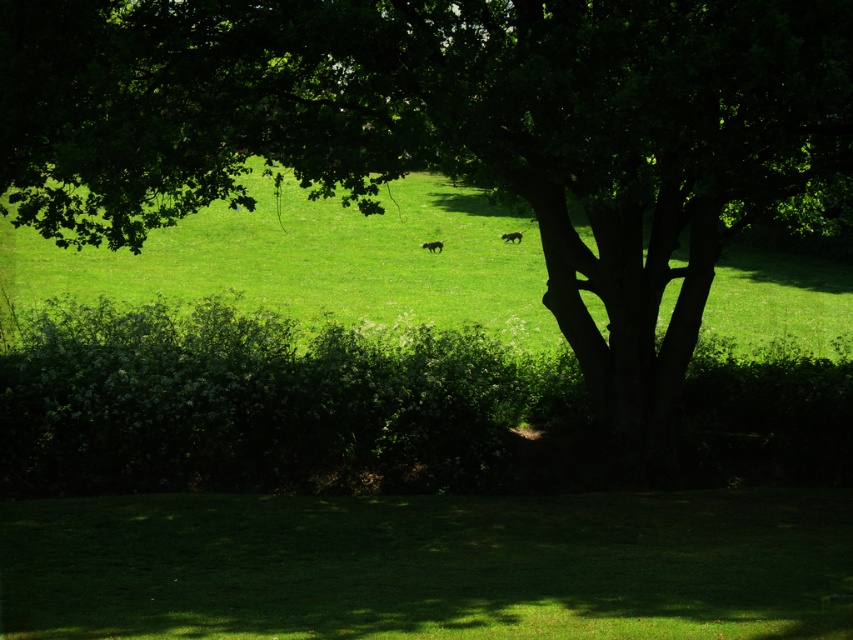
Question: Which point is closer to the camera taking this photo?

Choices:
 (A) (38, 400)
 (B) (428, 241)

Answer: (A)

Question: Which point appears farthest from the camera in this image?

Choices:
 (A) (142, 390)
 (B) (503, 234)

Answer: (B)

Question: Which of these objects is positioned closest to the green leafy tree at center?

Choices:
 (A) green leafy hedge at lower center
 (B) green grassy field at center
 (C) brown fur dog at center

Answer: (B)

Question: Does green leafy tree at center have a greater width compared to green leafy hedge at lower center?

Choices:
 (A) no
 (B) yes

Answer: (B)

Question: Can you confirm if green leafy tree at center is positioned above brown fur dog at center?

Choices:
 (A) no
 (B) yes

Answer: (A)

Question: Does green leafy tree at center have a smaller size compared to green grassy field at center?

Choices:
 (A) no
 (B) yes

Answer: (B)